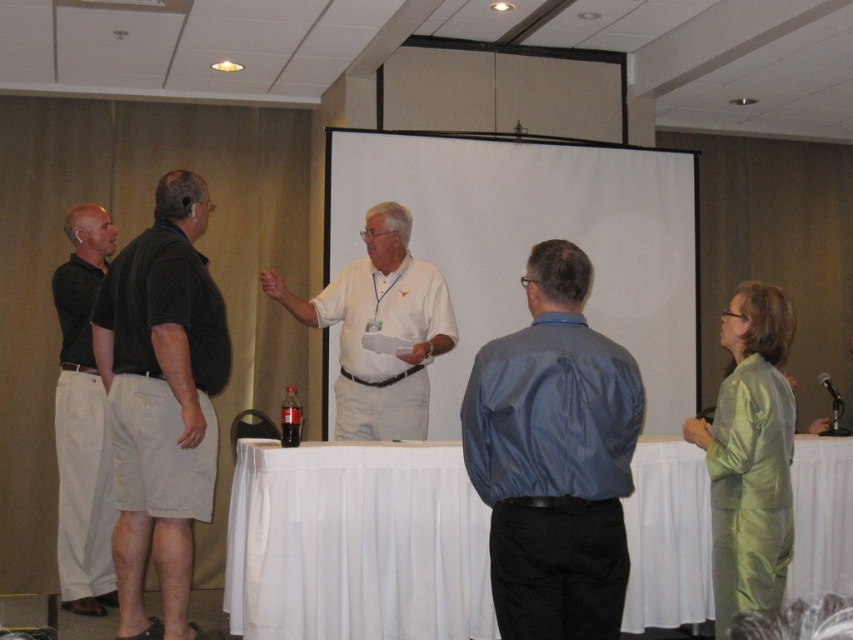
You are attending a meeting in a conference room and notice a point marked at coordinates [750,456]. What object is located at that position?

The point at coordinates [750,456] indicates the green satin dress at right.

You are organizing a photo shoot and need to arrange the green satin dress at right and the white matte shirt at center in a way that highlights their sizes. Which item should be placed on the left side to make the arrangement look balanced?

To create a balanced arrangement, the green satin dress at right, which has a lesser width compared to the white matte shirt at center, should be placed on the left side. This way, the wider white matte shirt at center can be positioned on the right to balance the visual weight.